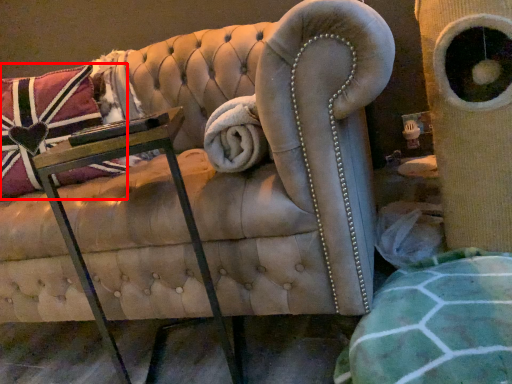
Question: From the image's perspective, where is throw pillow (annotated by the red box) located in relation to table in the image?

Choices:
 (A) above
 (B) below

Answer: (A)